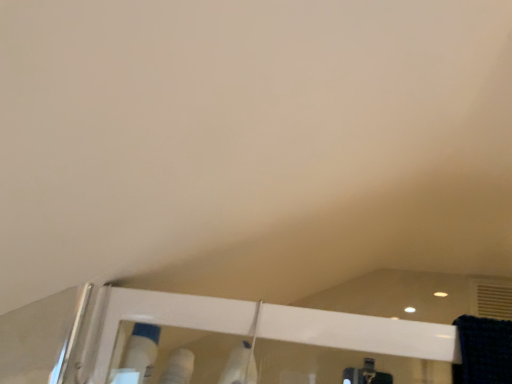
Image resolution: width=512 pixels, height=384 pixels. I want to click on white plastic bottle at lower center, so click(x=140, y=354).

This screenshot has height=384, width=512. Describe the element at coordinates (140, 354) in the screenshot. I see `white plastic bottle at lower center` at that location.

Identify the location of white plastic bottle at lower center. (140, 354).